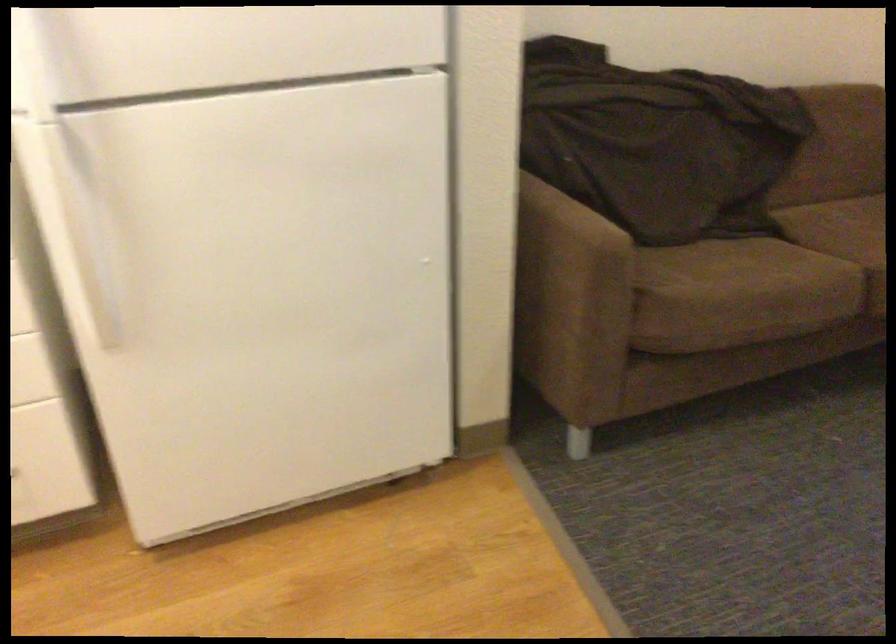
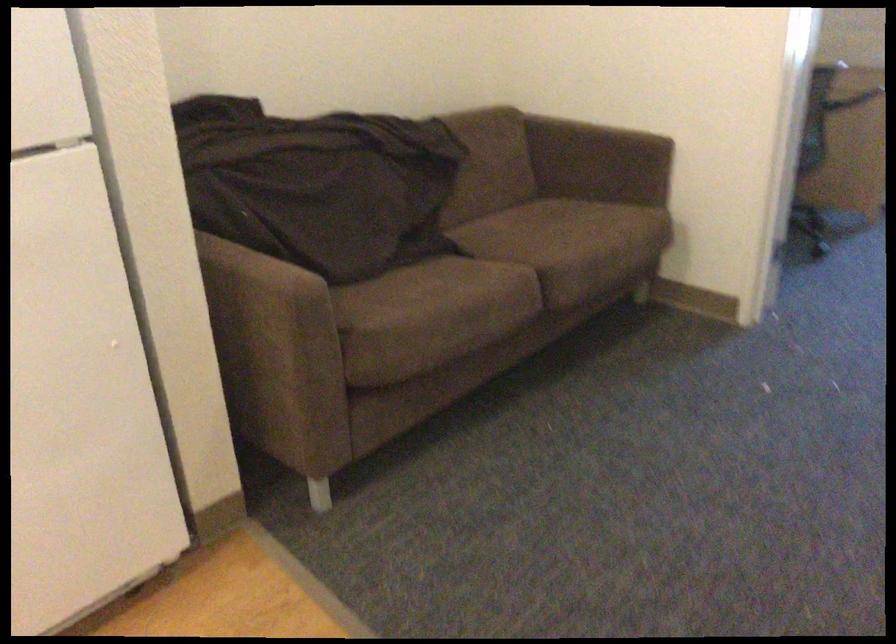
In the second image, find the point that corresponds to point (564, 287) in the first image.

(271, 342)